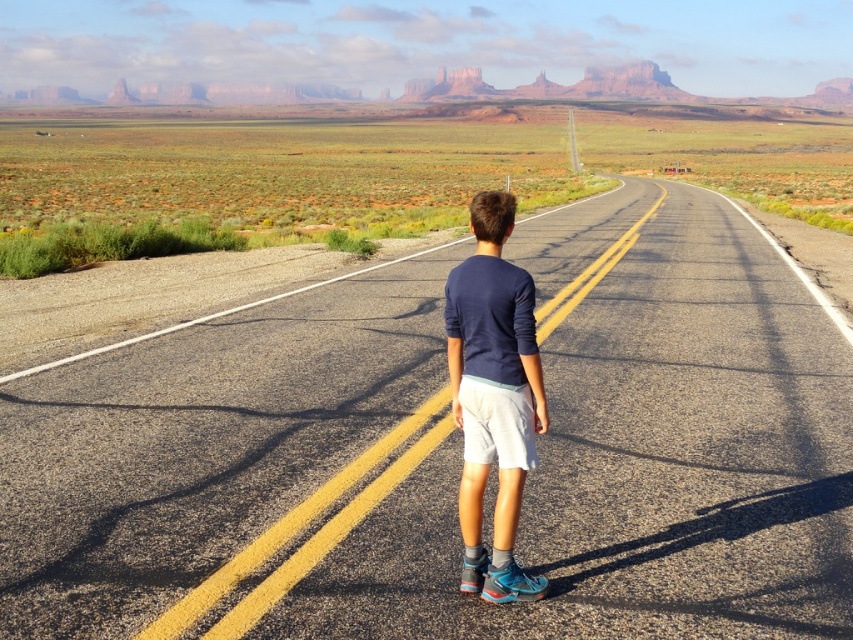
Can you confirm if asphalt road at center is bigger than navy blue shirt at center?

Correct, asphalt road at center is larger in size than navy blue shirt at center.

Does asphalt road at center have a greater height compared to navy blue shirt at center?

Yes.

Identify the location of asphalt road at center. (451, 454).

I want to click on asphalt road at center, so click(451, 454).